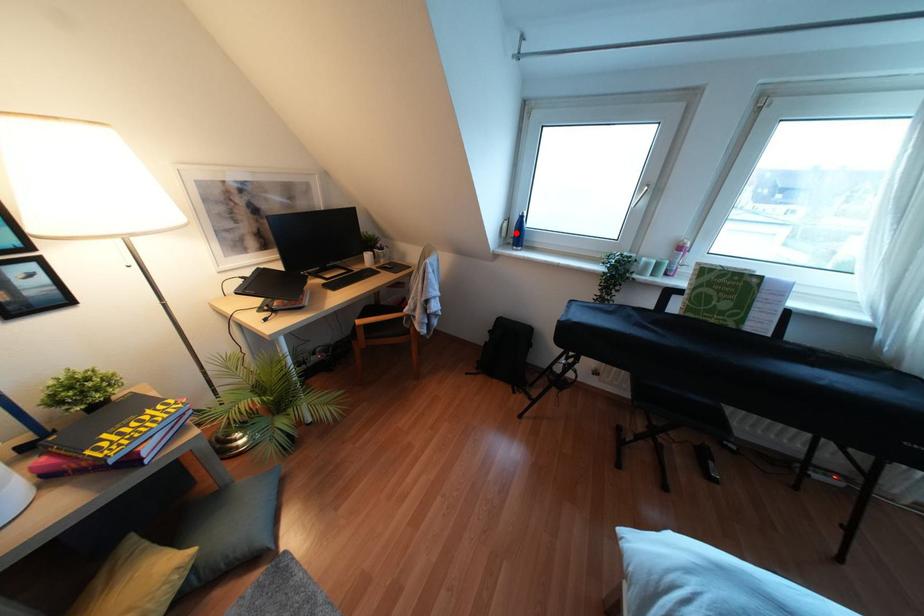
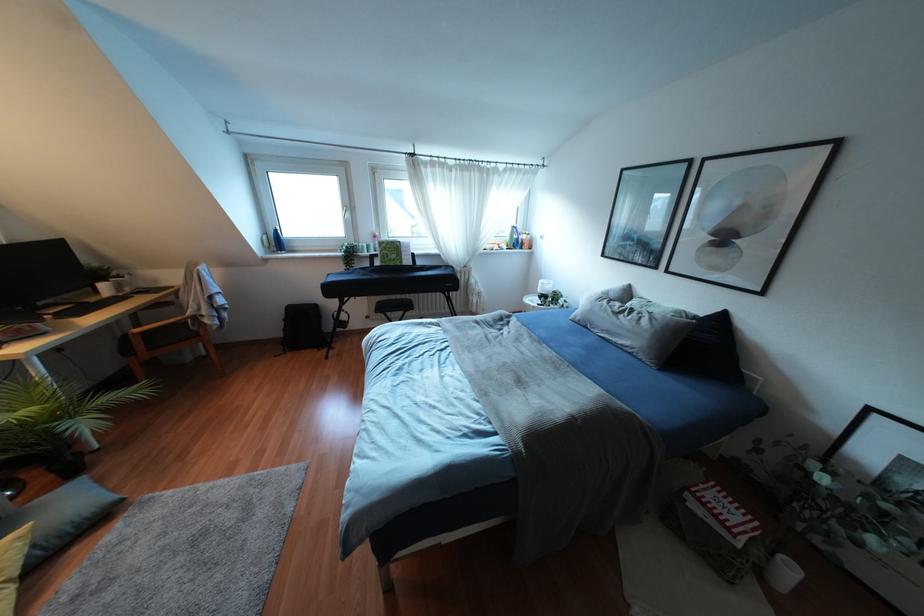
Find the pixel in the second image that matches the highlighted location in the first image.

(275, 241)